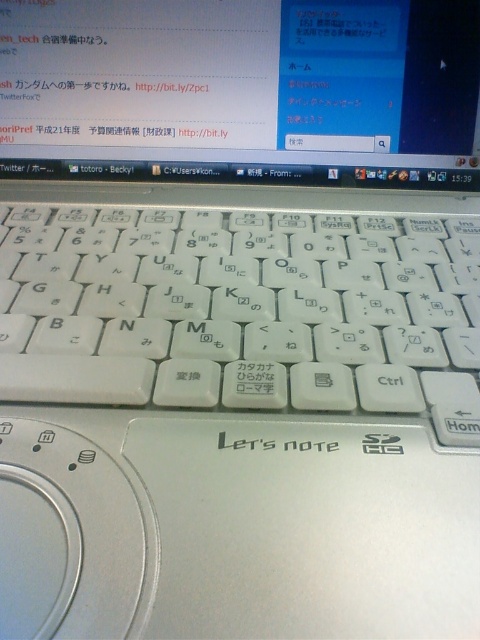
Question: Can you confirm if white plastic keyboard at center is thinner than matte white monitor at center?

Choices:
 (A) no
 (B) yes

Answer: (B)

Question: Which point is closer to the camera?

Choices:
 (A) white plastic keyboard at center
 (B) matte white monitor at center

Answer: (A)

Question: Which point appears farthest from the camera in this image?

Choices:
 (A) (444, 179)
 (B) (144, 256)

Answer: (A)

Question: Is white plastic keyboard at center to the right of matte white monitor at center from the viewer's perspective?

Choices:
 (A) yes
 (B) no

Answer: (B)

Question: Is white plastic keyboard at center positioned at the back of matte white monitor at center?

Choices:
 (A) yes
 (B) no

Answer: (B)